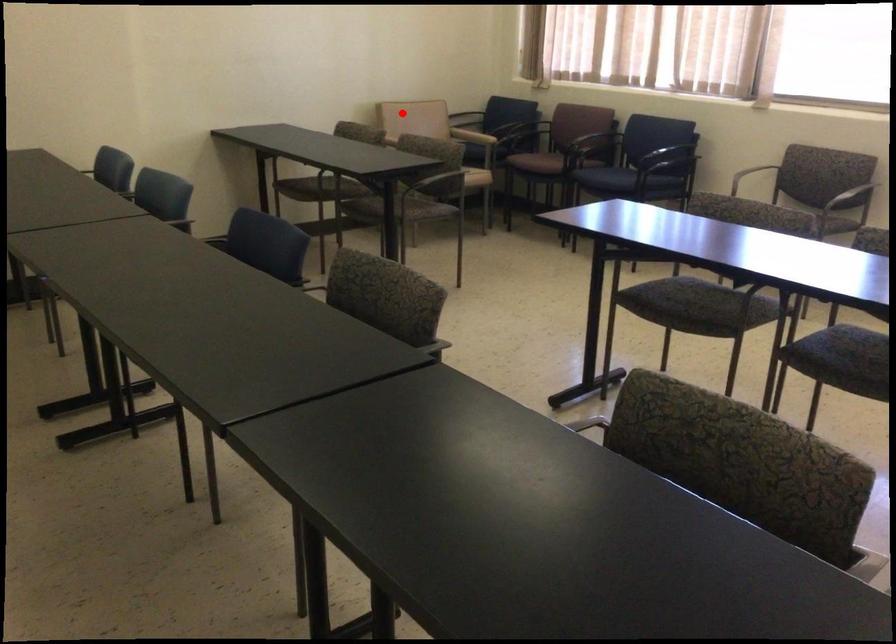
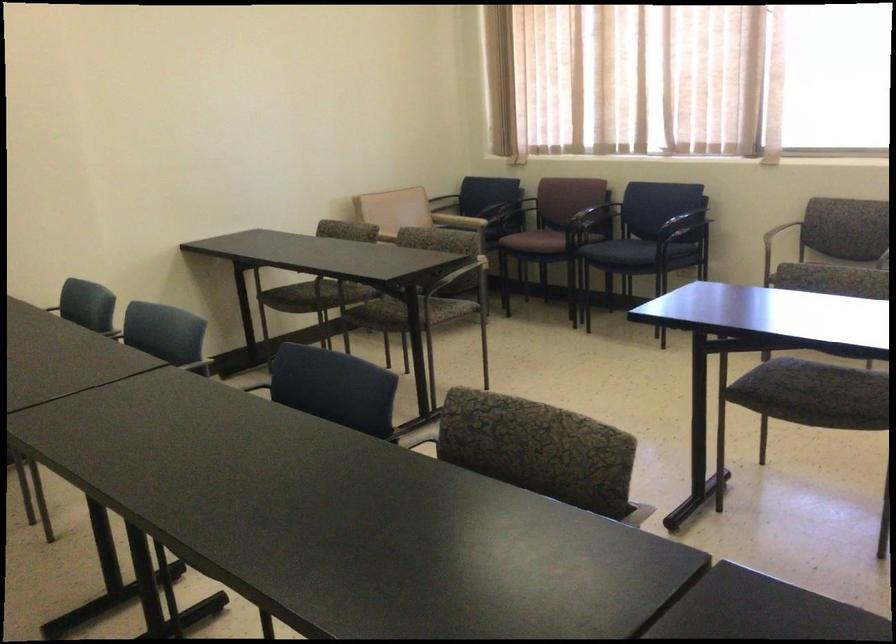
The point at the highlighted location is marked in the first image. Where is the corresponding point in the second image?

(381, 205)